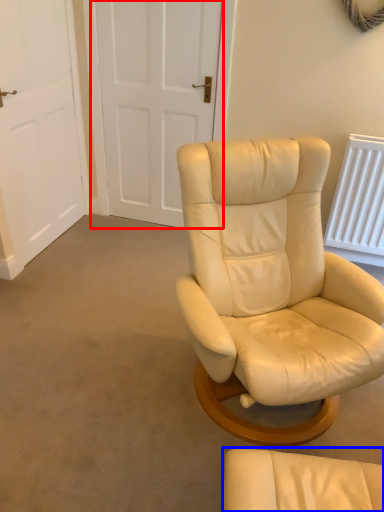
Question: Which of the following is the farthest to the observer, door (highlighted by a red box) or chair (highlighted by a blue box)?

Choices:
 (A) door
 (B) chair

Answer: (A)